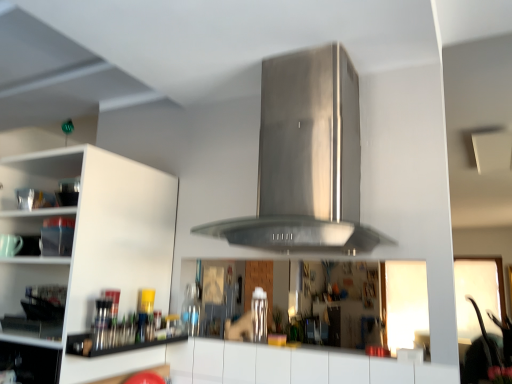
Question: Does metallic silver utensils at lower left have a lesser width compared to stainless steel vent at center?

Choices:
 (A) no
 (B) yes

Answer: (B)

Question: Is metallic silver utensils at lower left not inside stainless steel vent at center?

Choices:
 (A) yes
 (B) no

Answer: (A)

Question: From the image's perspective, is metallic silver utensils at lower left located beneath stainless steel vent at center?

Choices:
 (A) yes
 (B) no

Answer: (A)

Question: Is stainless steel vent at center inside metallic silver utensils at lower left?

Choices:
 (A) no
 (B) yes

Answer: (A)

Question: Can you confirm if metallic silver utensils at lower left is smaller than stainless steel vent at center?

Choices:
 (A) no
 (B) yes

Answer: (B)

Question: Would you say stainless steel vent at center is to the left or to the right of metallic silver utensils at lower left in the picture?

Choices:
 (A) left
 (B) right

Answer: (B)

Question: Would you say stainless steel vent at center is inside or outside metallic silver utensils at lower left?

Choices:
 (A) outside
 (B) inside

Answer: (A)

Question: Is stainless steel vent at center wider or thinner than metallic silver utensils at lower left?

Choices:
 (A) thin
 (B) wide

Answer: (B)

Question: From their relative heights in the image, would you say stainless steel vent at center is taller or shorter than metallic silver utensils at lower left?

Choices:
 (A) tall
 (B) short

Answer: (A)

Question: Is white matte cabinet at left bigger or smaller than stainless steel vent at center?

Choices:
 (A) small
 (B) big

Answer: (B)

Question: In terms of width, does white matte cabinet at left look wider or thinner when compared to stainless steel vent at center?

Choices:
 (A) thin
 (B) wide

Answer: (B)

Question: Is white matte cabinet at left taller or shorter than stainless steel vent at center?

Choices:
 (A) tall
 (B) short

Answer: (A)

Question: Would you say white matte cabinet at left is inside or outside stainless steel vent at center?

Choices:
 (A) inside
 (B) outside

Answer: (B)

Question: From a real-world perspective, relative to white matte cabinet at left, is stainless steel vent at center vertically above or below?

Choices:
 (A) below
 (B) above

Answer: (B)

Question: In terms of width, does stainless steel vent at center look wider or thinner when compared to white matte cabinet at left?

Choices:
 (A) wide
 (B) thin

Answer: (B)